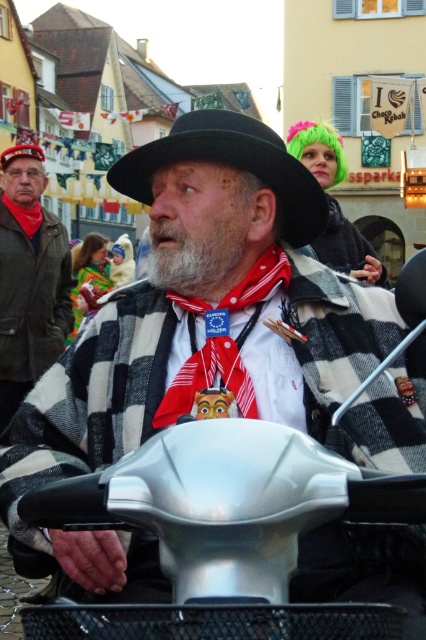
Is matte black jacket at left shorter than black felt hat at center?

Incorrect, matte black jacket at left's height does not fall short of black felt hat at center's.

Does point (8, 237) come farther from viewer compared to point (210, 124)?

Yes, point (8, 237) is behind point (210, 124).

Locate an element on the screen. The image size is (426, 640). matte black jacket at left is located at coordinates pos(28,278).

Is black felt hat at center shorter than black felt hat at upper center?

Indeed, black felt hat at center has a lesser height compared to black felt hat at upper center.

Is point (157, 141) less distant than point (20, 145)?

Yes, point (157, 141) is closer to viewer.

This screenshot has width=426, height=640. In order to click on black felt hat at center in this screenshot , I will do [x=230, y=166].

I want to click on graywoollybeard at center, so click(193, 252).

In the scene shown: Is graywoollybeard at center below black felt hat at upper center?

Correct, graywoollybeard at center is located below black felt hat at upper center.

Between point (186, 240) and point (3, 164), which one is positioned in front?

Point (186, 240) is more forward.

This screenshot has width=426, height=640. Identify the location of graywoollybeard at center. (193, 252).